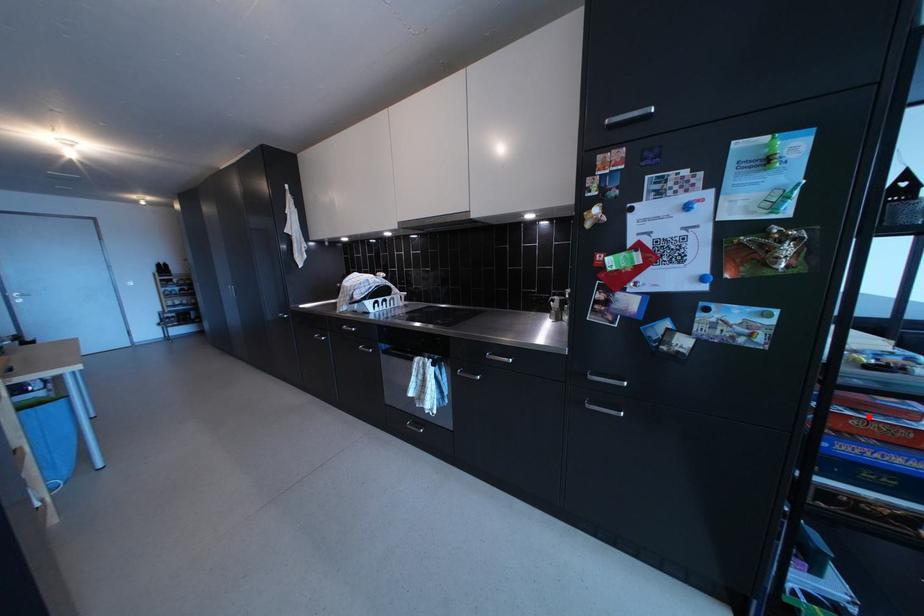
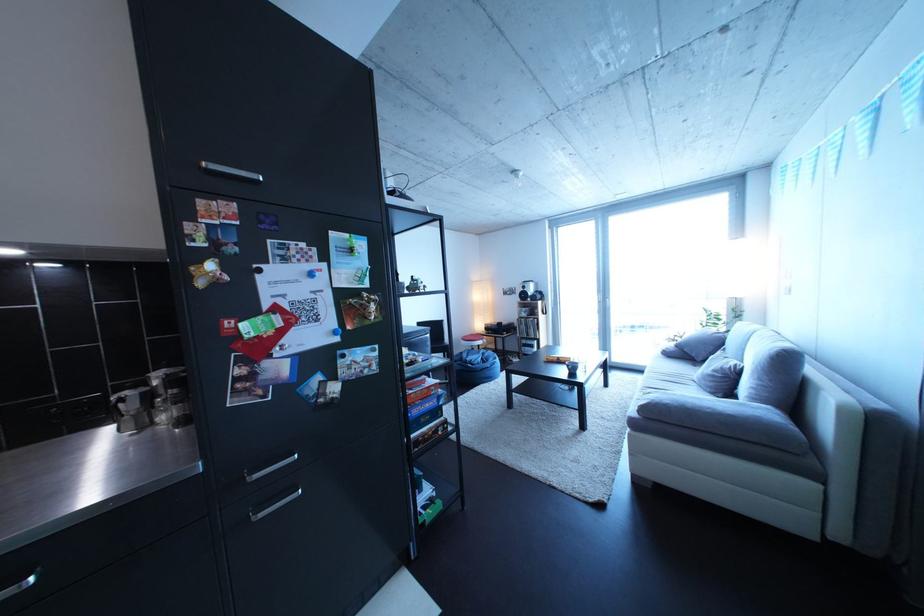
Find the pixel in the second image that matches the highlighted location in the first image.

(424, 395)